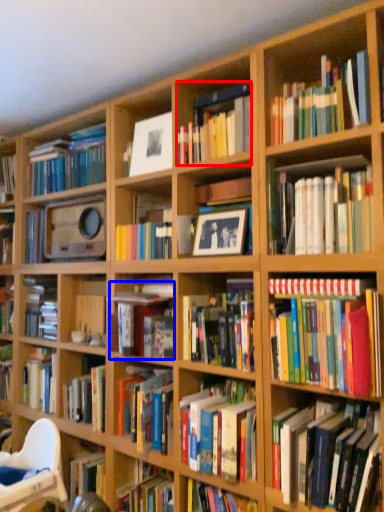
Question: Which of the following is the closest to the observer, book (highlighted by a red box) or book (highlighted by a blue box)?

Choices:
 (A) book
 (B) book

Answer: (A)